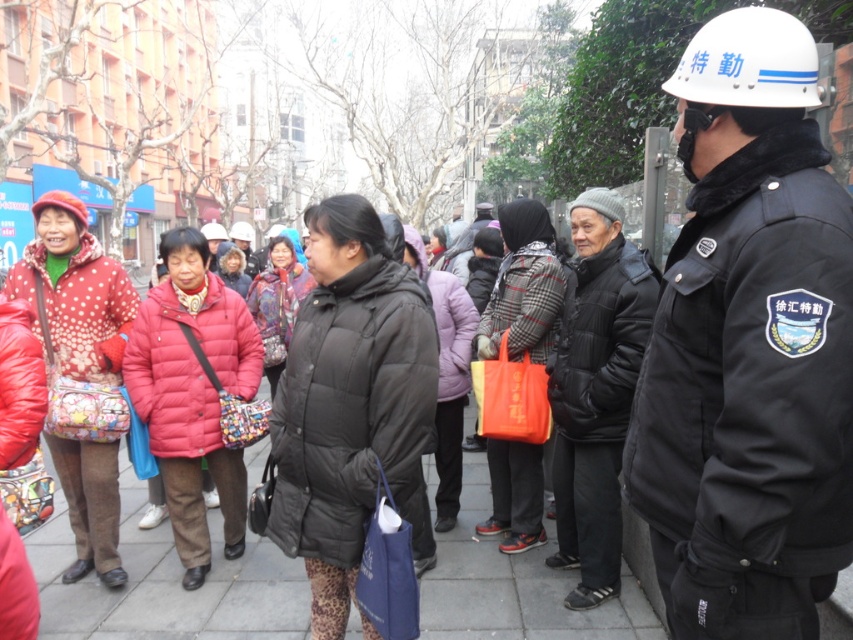
You are a photographer trying to capture both the black matte jacket at center and the matte pink puffer jacket at center in a single frame. Based on their positions, which jacket should you focus on first to ensure both are in the shot?

You should focus on the matte pink puffer jacket at center first since the black matte jacket at center is to the right of it, allowing you to adjust the frame to include both.